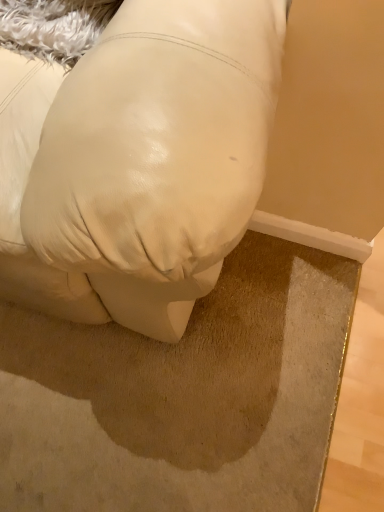
Locate an element on the screen. white leather pillow at lower center is located at coordinates (141, 163).

Describe the element at coordinates (141, 163) in the screenshot. The width and height of the screenshot is (384, 512). I see `white leather pillow at lower center` at that location.

Measure the distance between white leather pillow at lower center and camera.

They are 18.67 inches apart.

Find the location of a particular element. The image size is (384, 512). white leather pillow at lower center is located at coordinates (141, 163).